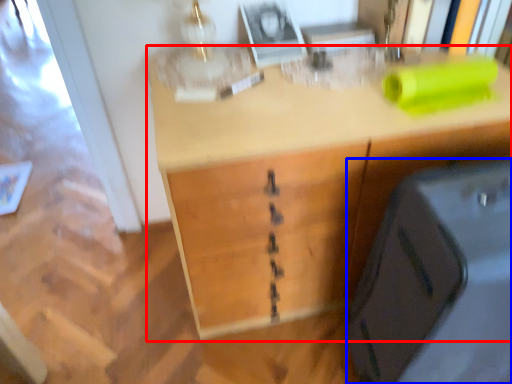
Question: Which object appears closest to the camera in this image, desk (highlighted by a red box) or luggage (highlighted by a blue box)?

Choices:
 (A) desk
 (B) luggage

Answer: (B)